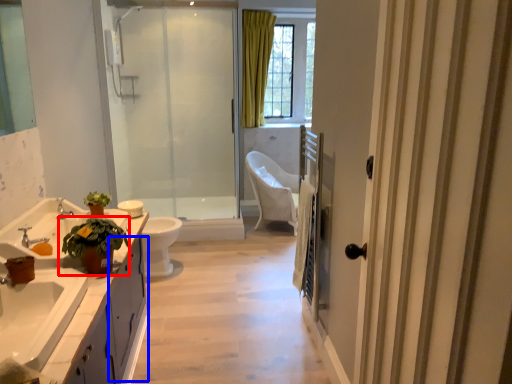
Question: Which object appears closest to the camera in this image, houseplant (highlighted by a red box) or cabinetry (highlighted by a blue box)?

Choices:
 (A) houseplant
 (B) cabinetry

Answer: (A)